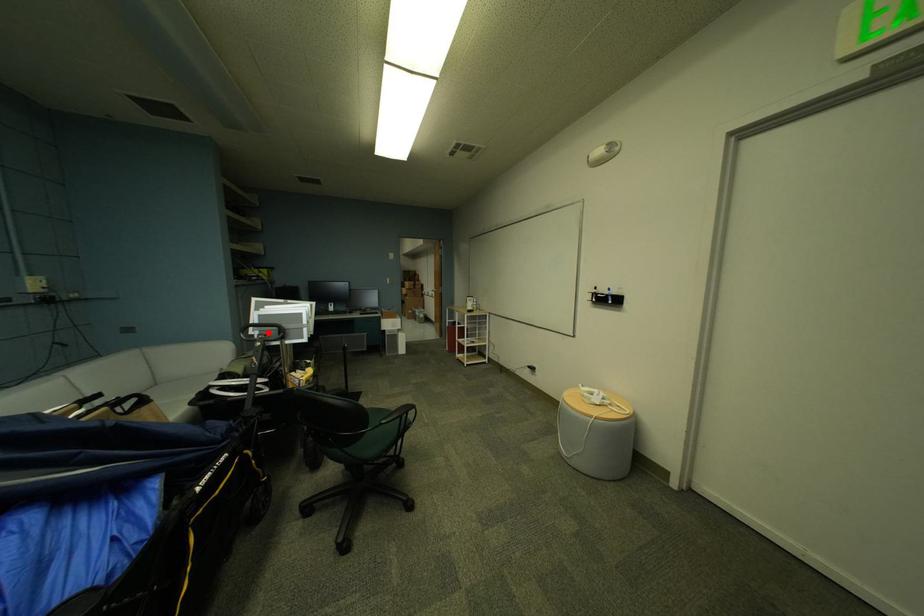
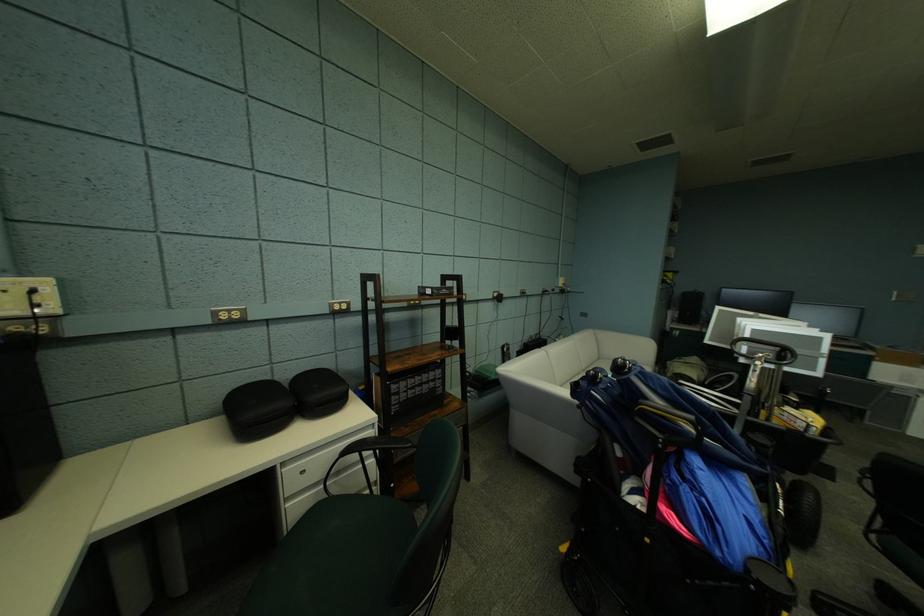
The point at the highlighted location is marked in the first image. Where is the corresponding point in the second image?

(758, 349)